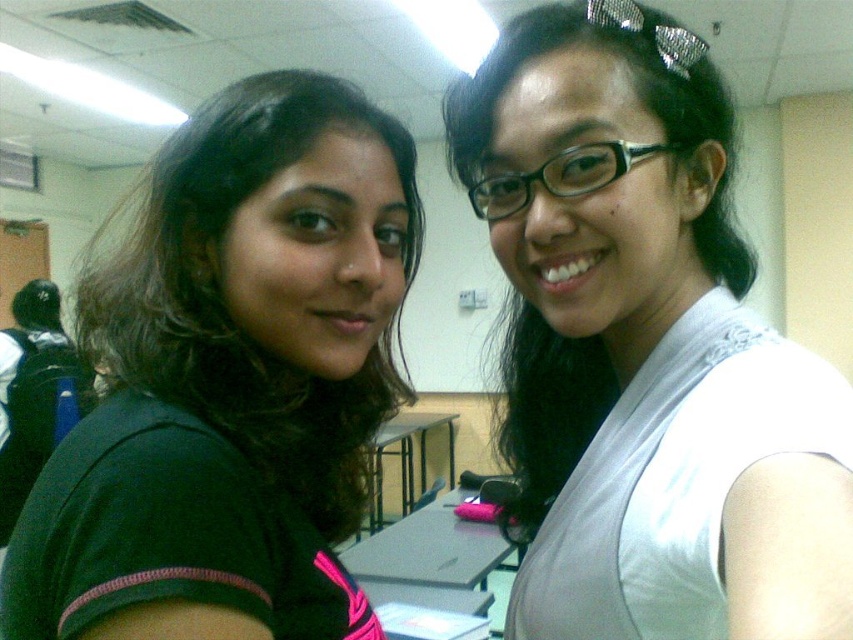
Question: Which object appears closest to the camera in this image?

Choices:
 (A) dark green fabric shirt at upper left
 (B) white matte vest at upper right

Answer: (B)

Question: Is white matte vest at upper right positioned behind dark green fabric shirt at upper left?

Choices:
 (A) yes
 (B) no

Answer: (B)

Question: Is white matte vest at upper right wider than dark green fabric shirt at upper left?

Choices:
 (A) yes
 (B) no

Answer: (B)

Question: Considering the relative positions of white matte vest at upper right and dark green fabric shirt at upper left in the image provided, where is white matte vest at upper right located with respect to dark green fabric shirt at upper left?

Choices:
 (A) left
 (B) right

Answer: (B)

Question: Which object is closer to the camera taking this photo?

Choices:
 (A) white matte vest at upper right
 (B) dark green fabric shirt at upper left

Answer: (A)